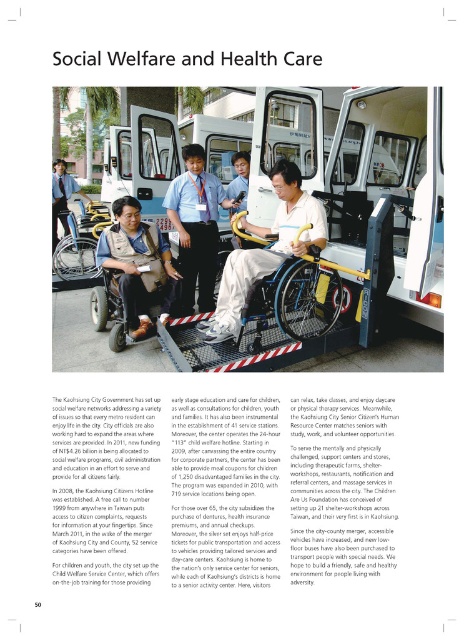
You are a person who needs to move a white plastic wheelchair at center and a matte black wheelchair at center closer together to load them onto a vehicle lift. The lift can only accommodate wheelchairs within a 3 meter distance from each other. Can you safely load both wheelchairs onto the lift without moving them?

The white plastic wheelchair at center is 2.97 meters away from the matte black wheelchair at center, which is within the 3 meter requirement. Therefore, both wheelchairs can be safely loaded onto the lift without needing to move them.